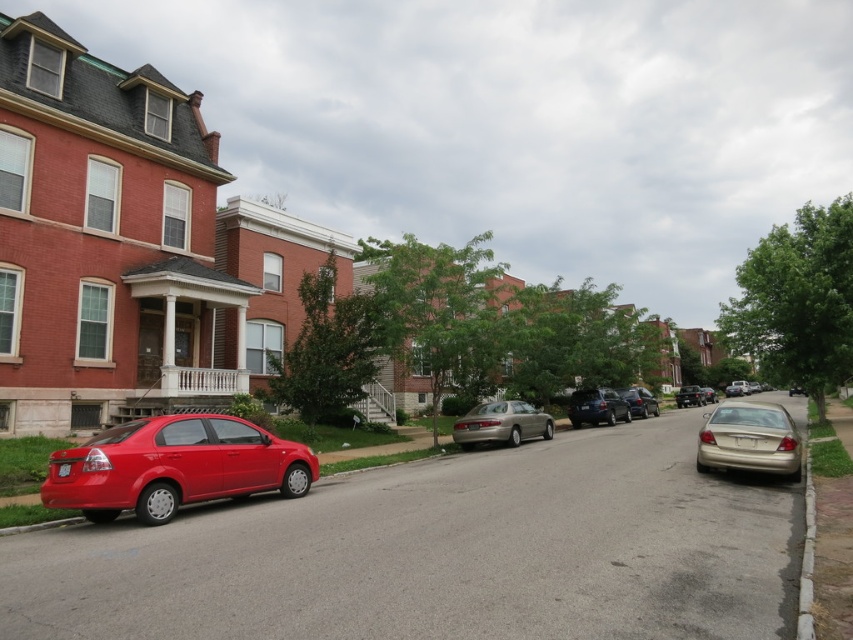
Question: Estimate the real-world distances between objects in this image. Which object is closer to the satin black suv at center?

Choices:
 (A) matte black sedan at center
 (B) gold metallic sedan at center
 (C) shiny black sedan at center
 (D) gold metallic sedan at right

Answer: (C)

Question: Where is shiny black sedan at center located in relation to matte black sedan at center in the image?

Choices:
 (A) below
 (B) above

Answer: (B)

Question: Which point is farther to the camera?

Choices:
 (A) matte red sedan at lower left
 (B) gold metallic sedan at center
 (C) satin black suv at center
 (D) shiny black sedan at center

Answer: (D)

Question: Among these objects, which one is farthest from the camera?

Choices:
 (A) gold metallic sedan at center
 (B) shiny black sedan at center
 (C) gold metallic sedan at right
 (D) white concrete curb at lower right

Answer: (B)

Question: Is shiny black sedan at center closer to camera compared to matte black sedan at center?

Choices:
 (A) no
 (B) yes

Answer: (B)

Question: Does matte red sedan at lower left appear on the left side of white concrete curb at lower right?

Choices:
 (A) yes
 (B) no

Answer: (A)